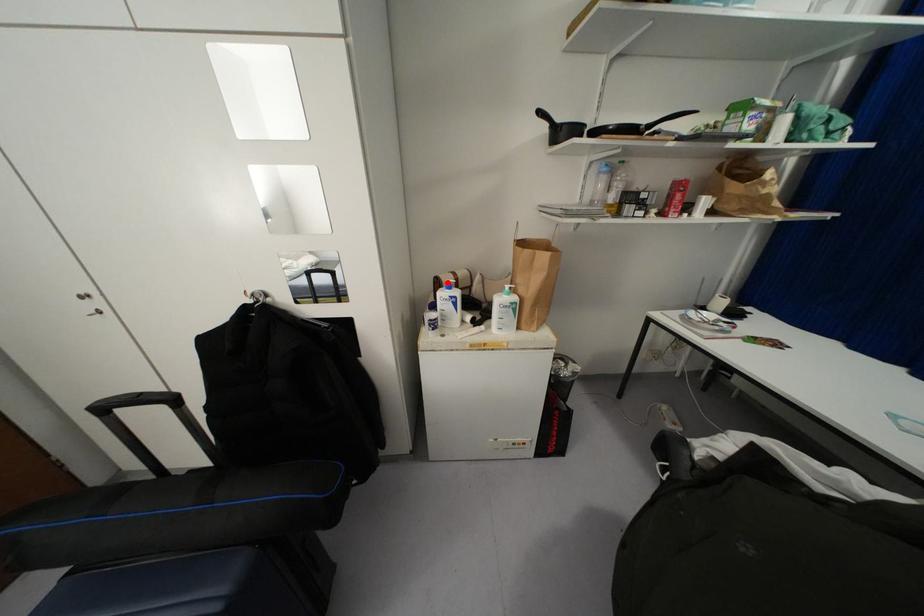
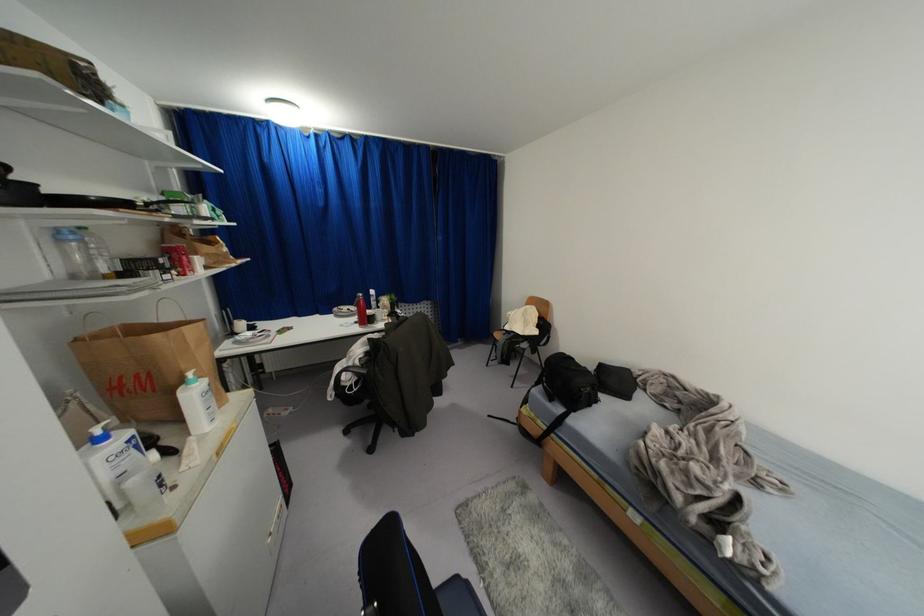
Question: I am providing you with two images of the same scene from different viewpoints. Given a red point in image1, look at the same physical point in image2. Is it:

Choices:
 (A) Closer to the viewpoint
 (B) Farther from the viewpoint

Answer: (B)